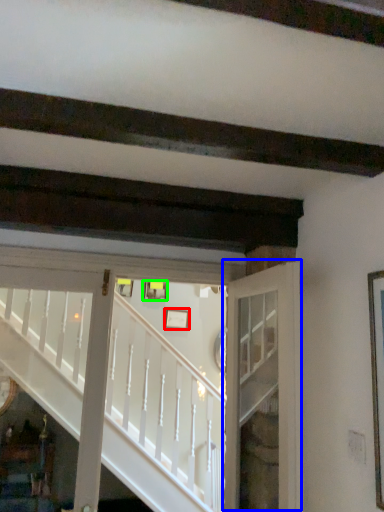
Question: Estimate the real-world distances between objects in this image. Which object is farther from picture frame (highlighted by a red box), door (highlighted by a blue box) or picture frame (highlighted by a green box)?

Choices:
 (A) door
 (B) picture frame

Answer: (A)